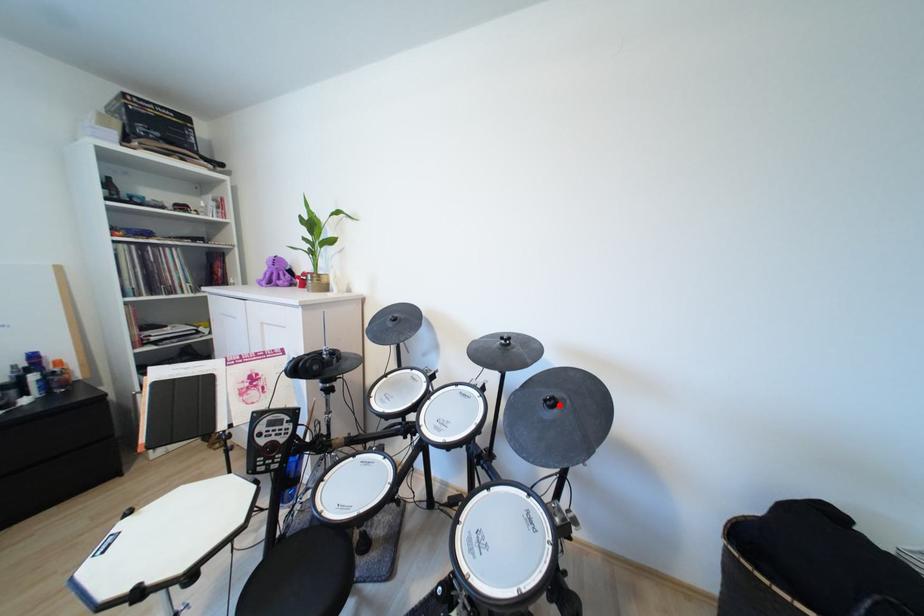
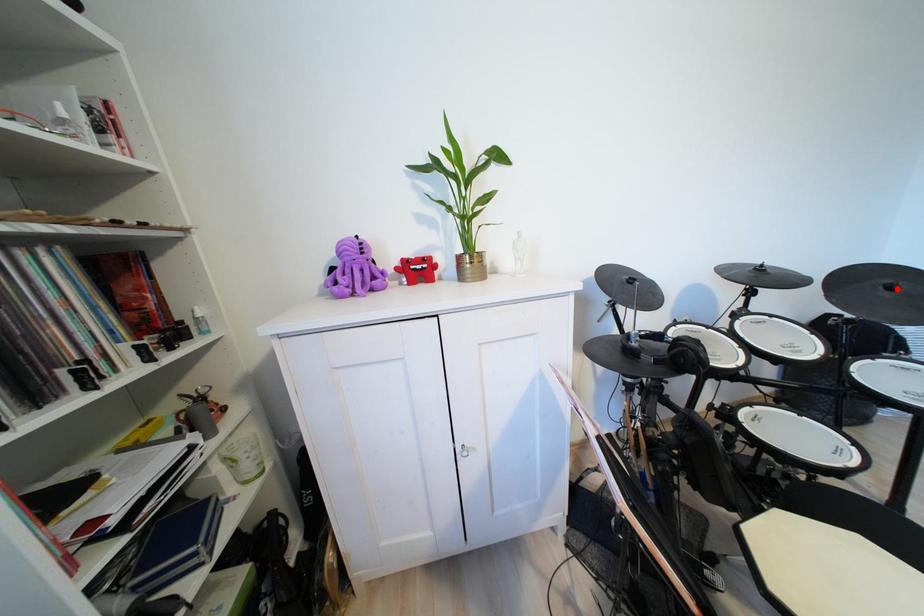
I am providing you with two images of the same scene from different viewpoints. A red point is marked on the first image and another point is marked on the second image. Do the highlighted points in image1 and image2 indicate the same real-world spot?

Yes